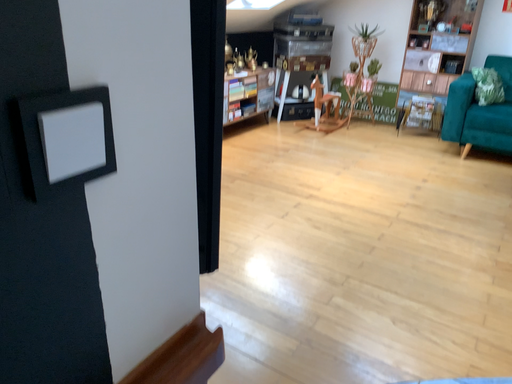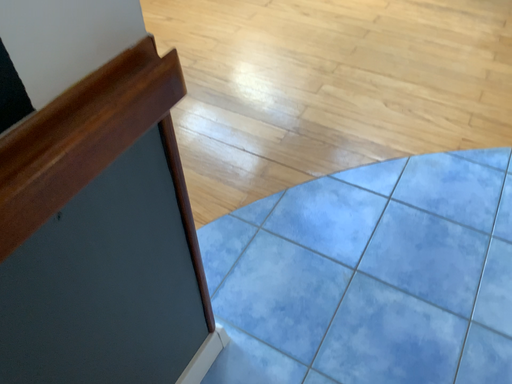
Question: Which way did the camera rotate in the video?

Choices:
 (A) rotated downward
 (B) rotated upward

Answer: (A)